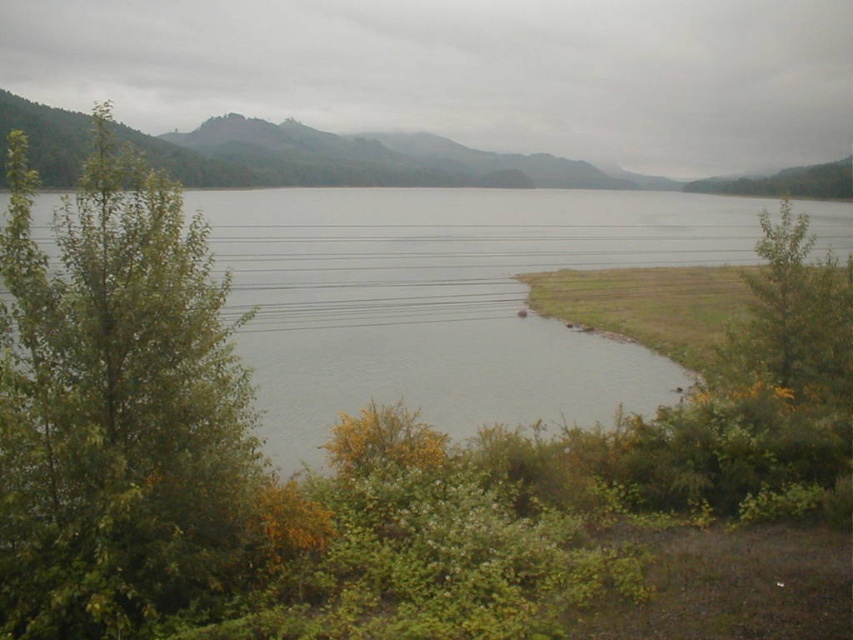
Question: Among these objects, which one is farthest from the camera?

Choices:
 (A) green leafy tree at left
 (B) clear water at center

Answer: (B)

Question: Does green leafy tree at left appear over clear water at center?

Choices:
 (A) no
 (B) yes

Answer: (A)

Question: In this image, where is green leafy tree at left located relative to clear water at center?

Choices:
 (A) left
 (B) right

Answer: (A)

Question: Which object is farther from the camera taking this photo?

Choices:
 (A) green leafy tree at left
 (B) clear water at center

Answer: (B)

Question: Does green leafy tree at left have a greater width compared to clear water at center?

Choices:
 (A) no
 (B) yes

Answer: (A)